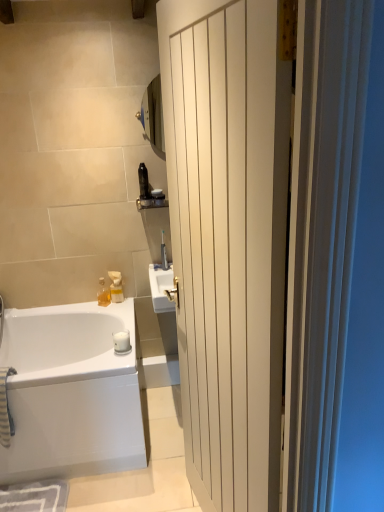
The width and height of the screenshot is (384, 512). I want to click on vacant space positioned to the left of translucent plastic soap dispenser at upper center, which appears as the second toiletry when viewed from the left, so click(92, 307).